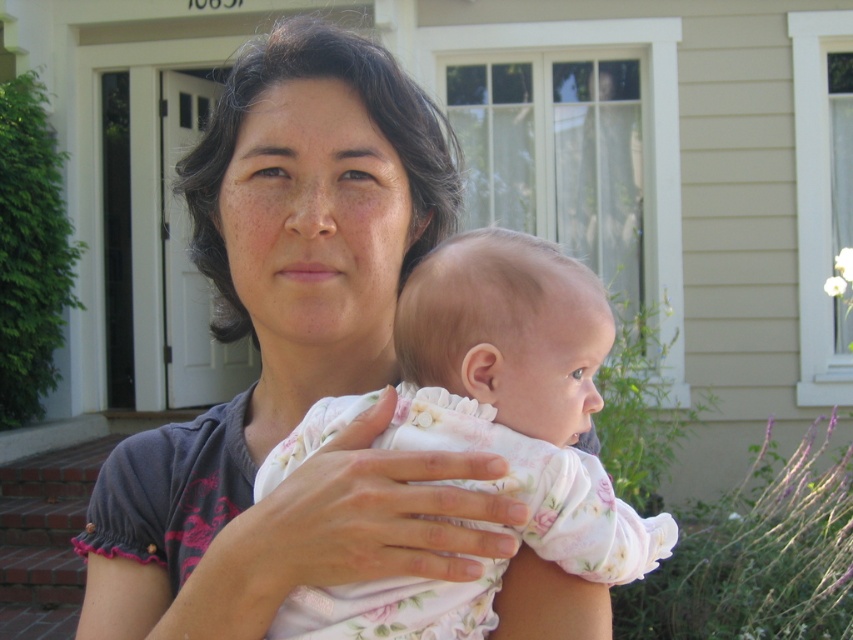
Is matte gray shirt at center positioned at the back of floral cotton baby at center?

No, matte gray shirt at center is closer to the viewer.

Based on the photo, does matte gray shirt at center have a lesser height compared to floral cotton baby at center?

No, matte gray shirt at center is not shorter than floral cotton baby at center.

Between point (305, 99) and point (397, 417), which one is positioned behind?

Point (305, 99)

The width and height of the screenshot is (853, 640). In order to click on matte gray shirt at center in this screenshot , I will do `click(306, 369)`.